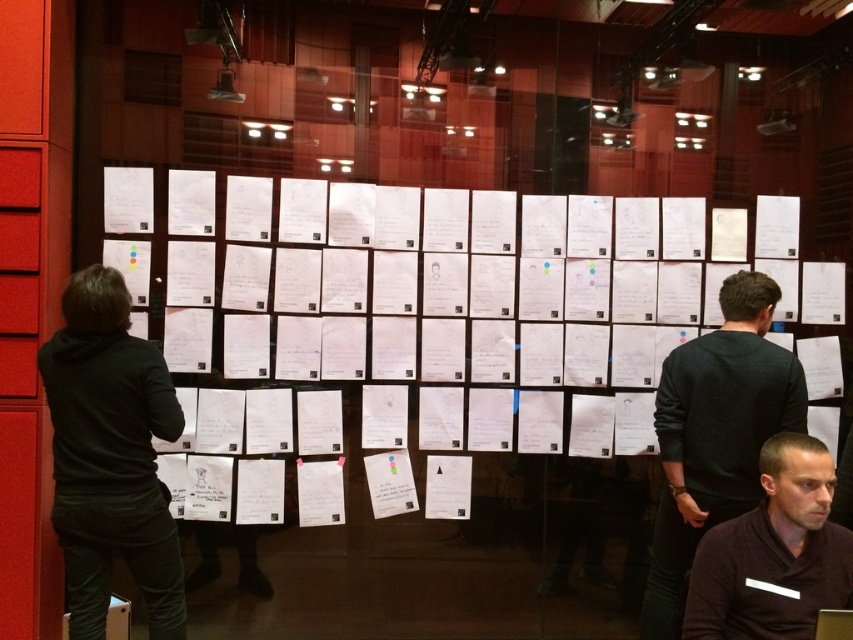
You are standing in the conference room and notice the white paper at center and the dark brown shirt at center. Based on their positions, which object is closer to you?

The white paper at center is closer to you because it is in front of the dark brown shirt at center, which is reflected in the glass wall.

You are standing in the conference room and notice the black sweater at center. Based on the reflection on the large glass wall, can you determine if the sweater is closer to the glass wall or further away from it?

The black sweater at center is located at point (715,435) in the reflection, which indicates its position relative to the glass wall. Since reflections on glass typically show objects behind them mirrored, the sweater being at the center suggests it is positioned in front of the glass wall, making it closer to the glass wall.